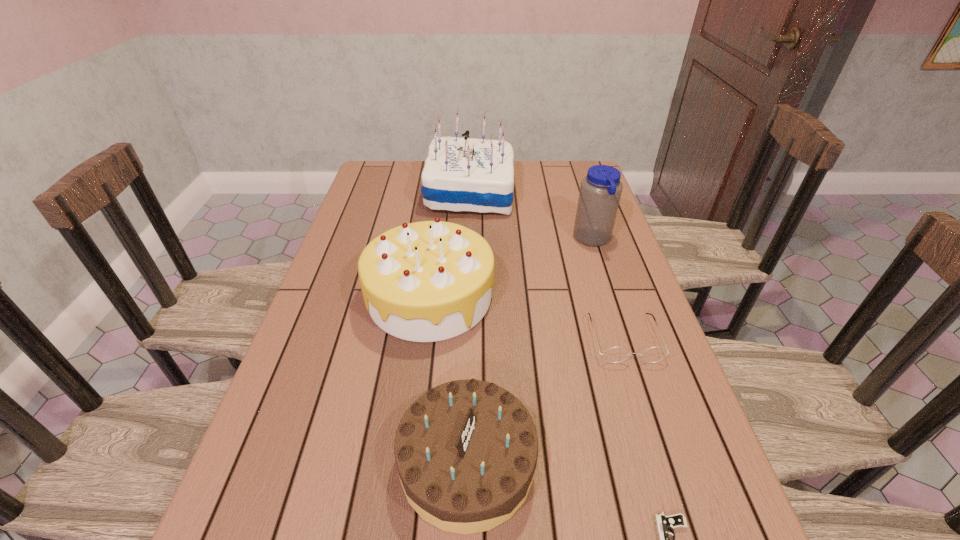
I want to click on vacant space at the right edge of the desktop, so click(597, 249).

The image size is (960, 540). In order to click on vacant space at the far left corner of the desktop in this screenshot , I will do `click(379, 165)`.

At what (x,y) coordinates should I click in order to perform the action: click on blank space at the far right corner of the desktop. Please return your answer as a coordinate pair (x, y). This screenshot has width=960, height=540. Looking at the image, I should click on (551, 176).

The width and height of the screenshot is (960, 540). In order to click on vacant space that is in between the second farthest birthday cake and the second farthest object in this screenshot , I will do `click(512, 268)`.

Find the location of a particular element. This screenshot has width=960, height=540. empty space that is in between the second shortest object and the shortest birthday cake is located at coordinates (545, 401).

Where is `free space between the fifth nearest object and the tallest object`? Image resolution: width=960 pixels, height=540 pixels. free space between the fifth nearest object and the tallest object is located at coordinates pyautogui.click(x=531, y=217).

Image resolution: width=960 pixels, height=540 pixels. I want to click on vacant point located between the fifth tallest object and the water bottle, so click(x=608, y=289).

Where is `vacant area that lies between the water bottle and the second shortest object`? The image size is (960, 540). vacant area that lies between the water bottle and the second shortest object is located at coordinates (608, 289).

Where is `object that is the closest to the water bottle`? object that is the closest to the water bottle is located at coordinates 460,174.

Image resolution: width=960 pixels, height=540 pixels. Identify the location of object that is the fifth closest to the fifth tallest object. (460, 174).